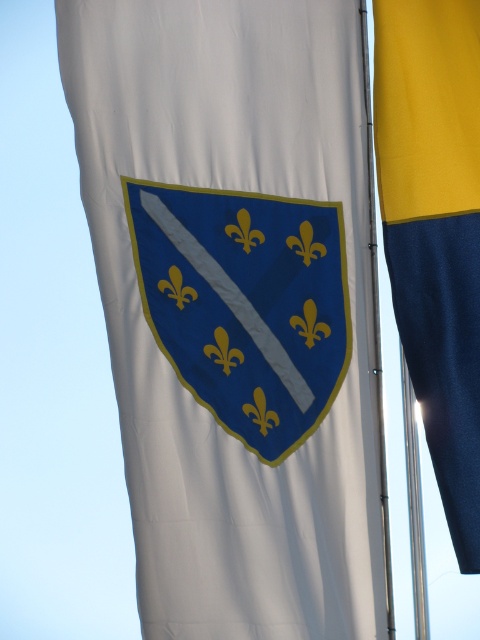
Question: Can you confirm if blue fabric shield at center is positioned to the left of yellow fabric flag at right?

Choices:
 (A) no
 (B) yes

Answer: (B)

Question: Which point is closer to the camera?

Choices:
 (A) yellow fabric flag at right
 (B) metallic silver pole at center
 (C) blue fabric shield at center

Answer: (A)

Question: Does yellow fabric flag at right appear on the left side of metallic silver pole at center?

Choices:
 (A) no
 (B) yes

Answer: (A)

Question: Does blue fabric shield at center appear on the left side of metallic silver pole at center?

Choices:
 (A) yes
 (B) no

Answer: (A)

Question: Which object is the closest to the yellow fabric flag at right?

Choices:
 (A) metallic silver pole at center
 (B) blue fabric shield at center

Answer: (A)

Question: Estimate the real-world distances between objects in this image. Which object is farther from the metallic silver pole at center?

Choices:
 (A) blue fabric shield at center
 (B) yellow fabric flag at right

Answer: (A)